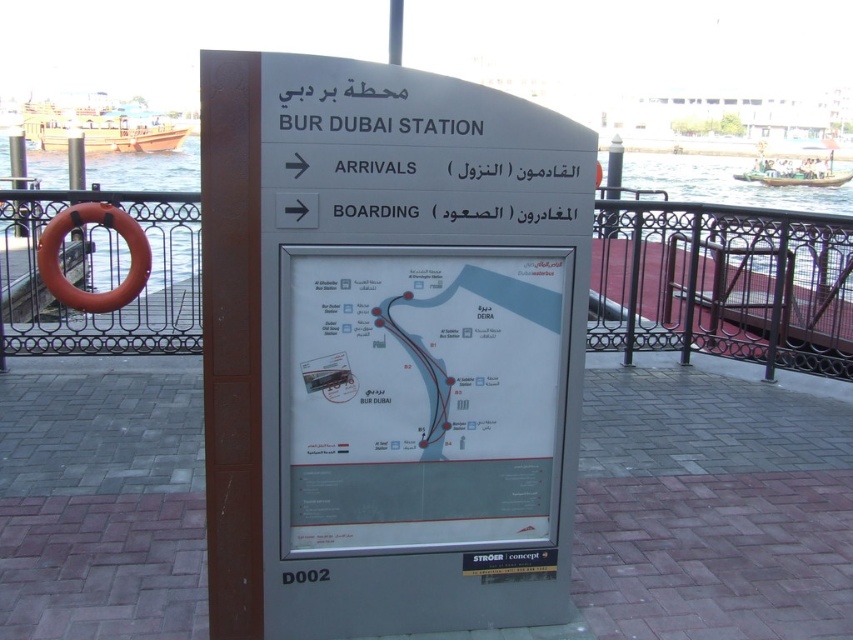
You are at Bur Dubai Station and need to reach the ARRIVALS area. You see a white plastic sign at center and an orange rubber ring at left. Which object is taller and can help you locate the direction to ARRIVALS?

The white plastic sign at center is much taller than the orange rubber ring at left and contains directional arrows pointing towards ARRIVALS, so it can help you locate the direction to ARRIVALS.

You are a tourist holding a 10 feet long guide rope and want to secure it between the white paper map at center and the orange rubber ring at left. Can you do this without the rope touching the water?

The distance between the white paper map at center and the orange rubber ring at left is 11.81 feet, which is longer than your 10 feet guide rope. Therefore, the rope cannot span the entire distance without touching the water.

What is the spatial relationship between the white plastic sign at center and the metal railing in the background?

The white plastic sign at center is positioned closer to the viewer than the metal railing in the background.